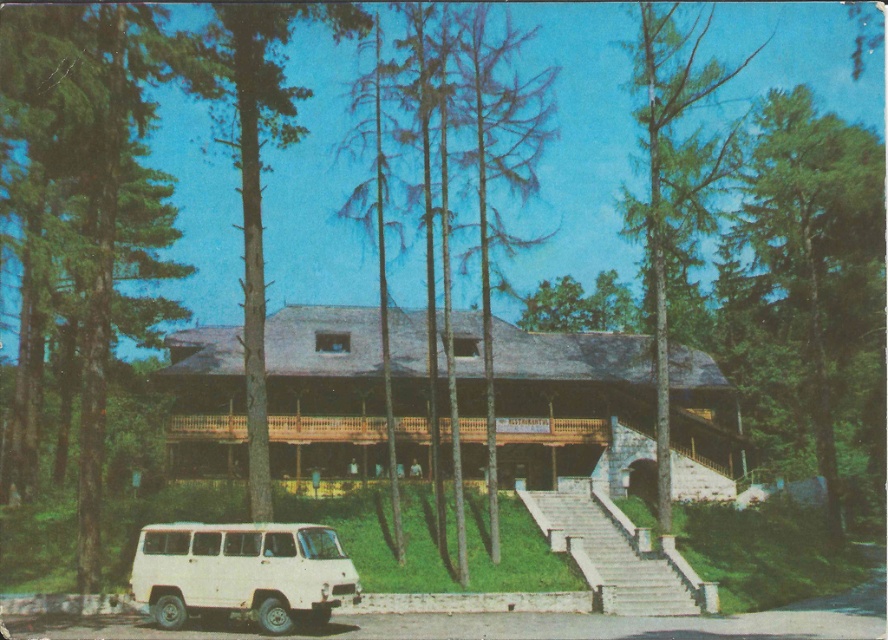
Question: Is white matte van at lower left wider than green wood tree at center?

Choices:
 (A) no
 (B) yes

Answer: (A)

Question: Which object appears closest to the camera in this image?

Choices:
 (A) green textured tree at right
 (B) green wood tree at center
 (C) green leafy tree at center

Answer: (B)

Question: Estimate the real-world distances between objects in this image. Which object is closer to the green wood tree at center?

Choices:
 (A) white matte van at lower left
 (B) green leafy tree at center
 (C) green textured tree at right

Answer: (B)

Question: Which object is the farthest from the green textured tree at left?

Choices:
 (A) white stone stairs at center
 (B) green leafy tree at center
 (C) white matte van at lower left
 (D) green wood tree at center

Answer: (B)

Question: Is white matte van at lower left above white stone stairs at center?

Choices:
 (A) no
 (B) yes

Answer: (B)

Question: Is the position of green leafy tree at center less distant than that of white stone stairs at center?

Choices:
 (A) yes
 (B) no

Answer: (B)